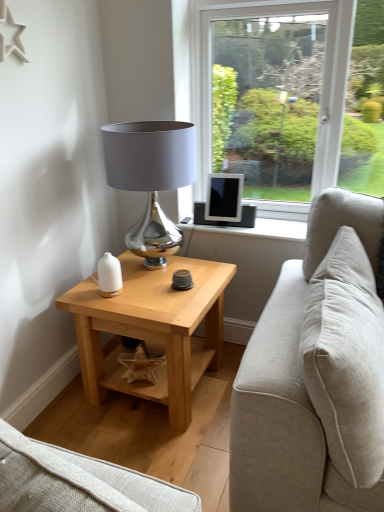
Question: Based on their positions, is beige fabric pillow at right located to the left or right of light wood/texture side table at lower left?

Choices:
 (A) left
 (B) right

Answer: (B)

Question: From the image's perspective, relative to light wood/texture side table at lower left, is beige fabric pillow at right above or below?

Choices:
 (A) above
 (B) below

Answer: (A)

Question: Which of these objects is positioned farthest from the shiny metallic lampshade at center?

Choices:
 (A) beige fabric pillow at right
 (B) matte black tablet at upper right
 (C) light wood/texture side table at lower left

Answer: (A)

Question: Which of these objects is positioned closest to the matte black tablet at upper right?

Choices:
 (A) shiny metallic lampshade at center
 (B) beige fabric pillow at right
 (C) light wood/texture side table at lower left

Answer: (A)